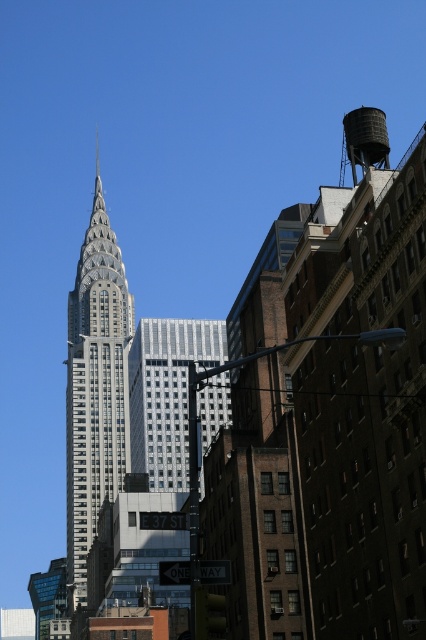
Question: Which point is farther from the camera taking this photo?

Choices:
 (A) (97, 497)
 (B) (344, 131)
 (C) (175, 376)

Answer: (B)

Question: Is silver glass building at center positioned at the back of matte gray water tower at upper right?

Choices:
 (A) yes
 (B) no

Answer: (A)

Question: Can you confirm if gray stone tower at center is positioned below matte gray water tower at upper right?

Choices:
 (A) yes
 (B) no

Answer: (A)

Question: Can you confirm if gray stone tower at center is bigger than silver glass building at center?

Choices:
 (A) yes
 (B) no

Answer: (A)

Question: Which object is the closest to the gray stone tower at center?

Choices:
 (A) silver glass building at center
 (B) matte gray water tower at upper right

Answer: (A)

Question: Which point is farther to the camera?

Choices:
 (A) silver glass building at center
 (B) gray stone tower at center
 (C) matte gray water tower at upper right

Answer: (B)